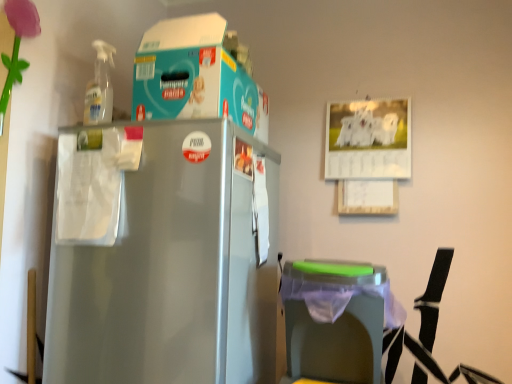
This screenshot has width=512, height=384. Describe the element at coordinates (197, 75) in the screenshot. I see `teal cardboard box at upper center` at that location.

The image size is (512, 384). Identify the location of teal cardboard box at upper center. (197, 75).

What do you see at coordinates (334, 327) in the screenshot?
I see `green plastic trash can at lower right` at bounding box center [334, 327].

Consider the image. Measure the distance between point (373, 378) and camera.

Point (373, 378) and camera are 3.78 feet apart.

Locate an element on the screen. green plastic trash can at lower right is located at coordinates (334, 327).

Locate an element on the screen. teal cardboard box at upper center is located at coordinates (197, 75).

Is green plastic trash can at lower right at the left side of teal cardboard box at upper center?

In fact, green plastic trash can at lower right is to the right of teal cardboard box at upper center.

Is green plastic trash can at lower right in front of teal cardboard box at upper center?

Yes, the depth of green plastic trash can at lower right is less than that of teal cardboard box at upper center.

Considering the points (345, 333) and (170, 104), which point is behind, point (345, 333) or point (170, 104)?

Positioned behind is point (170, 104).

From the image's perspective, which is below, green plastic trash can at lower right or teal cardboard box at upper center?

green plastic trash can at lower right is shown below in the image.

From a real-world perspective, which is physically above, green plastic trash can at lower right or teal cardboard box at upper center?

From a 3D spatial view, teal cardboard box at upper center is above.

Between green plastic trash can at lower right and teal cardboard box at upper center, which one has smaller width?

green plastic trash can at lower right is thinner.

Between green plastic trash can at lower right and teal cardboard box at upper center, which one has less height?

teal cardboard box at upper center.

Looking at this image, who is smaller, green plastic trash can at lower right or teal cardboard box at upper center?

green plastic trash can at lower right is smaller.

Is green plastic trash can at lower right positioned beyond the bounds of teal cardboard box at upper center?

Indeed, green plastic trash can at lower right is completely outside teal cardboard box at upper center.

Is green plastic trash can at lower right next to teal cardboard box at upper center?

No, green plastic trash can at lower right is not next to teal cardboard box at upper center.

Is green plastic trash can at lower right facing towards teal cardboard box at upper center?

No.

How many degrees apart are the facing directions of green plastic trash can at lower right and teal cardboard box at upper center?

green plastic trash can at lower right and teal cardboard box at upper center are facing 2.62 degrees away from each other.

Find the location of a particular element. The width and height of the screenshot is (512, 384). storage box on the left of green plastic trash can at lower right is located at coordinates (197, 75).

Considering the positions of objects teal cardboard box at upper center and green plastic trash can at lower right in the image provided, who is more to the left, teal cardboard box at upper center or green plastic trash can at lower right?

teal cardboard box at upper center.

Is the depth of teal cardboard box at upper center greater than that of green plastic trash can at lower right?

Yes, teal cardboard box at upper center is further from the viewer.

Considering the positions of points (192, 70) and (288, 306), is point (192, 70) closer to camera compared to point (288, 306)?

That is False.

From the image's perspective, is teal cardboard box at upper center above green plastic trash can at lower right?

Correct, teal cardboard box at upper center appears higher than green plastic trash can at lower right in the image.

From a real-world perspective, which object stands above the other?

teal cardboard box at upper center is physically above.

Between teal cardboard box at upper center and green plastic trash can at lower right, which one has smaller width?

Thinner between the two is green plastic trash can at lower right.

Between teal cardboard box at upper center and green plastic trash can at lower right, which one has less height?

teal cardboard box at upper center is shorter.

Is teal cardboard box at upper center bigger than green plastic trash can at lower right?

Correct, teal cardboard box at upper center is larger in size than green plastic trash can at lower right.

Is teal cardboard box at upper center located outside green plastic trash can at lower right?

teal cardboard box at upper center lies outside green plastic trash can at lower right's area.

Is teal cardboard box at upper center positioned far away from green plastic trash can at lower right?

teal cardboard box at upper center is near green plastic trash can at lower right, not far away.

Is teal cardboard box at upper center oriented away from green plastic trash can at lower right?

No, teal cardboard box at upper center is not facing the opposite direction of green plastic trash can at lower right.

From the picture: Can you tell me how much teal cardboard box at upper center and green plastic trash can at lower right differ in facing direction?

2.62 degrees.

Where is `table below the teal cardboard box at upper center (from a real-world perspective)`? The image size is (512, 384). table below the teal cardboard box at upper center (from a real-world perspective) is located at coordinates (334, 327).

This screenshot has width=512, height=384. I want to click on table below the teal cardboard box at upper center (from a real-world perspective), so pyautogui.click(x=334, y=327).

Identify the location of storage box above the green plastic trash can at lower right (from a real-world perspective). (197, 75).